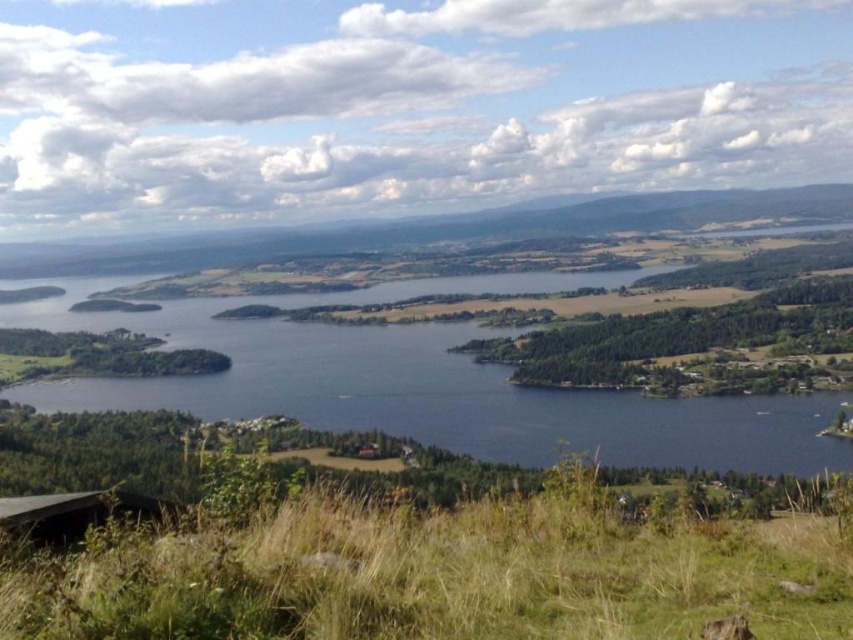
Question: In this image, where is green grassy at lower center located relative to blue water at center?

Choices:
 (A) below
 (B) above

Answer: (A)

Question: Among these objects, which one is farthest from the camera?

Choices:
 (A) blue water at center
 (B) green grassy at lower center

Answer: (A)

Question: Is green grassy at lower center wider than blue water at center?

Choices:
 (A) yes
 (B) no

Answer: (B)

Question: Which object is farther from the camera taking this photo?

Choices:
 (A) green grassy at lower center
 (B) blue water at center

Answer: (B)

Question: Among these objects, which one is nearest to the camera?

Choices:
 (A) green grassy at lower center
 (B) blue water at center

Answer: (A)

Question: Does green grassy at lower center have a lesser width compared to blue water at center?

Choices:
 (A) yes
 (B) no

Answer: (A)